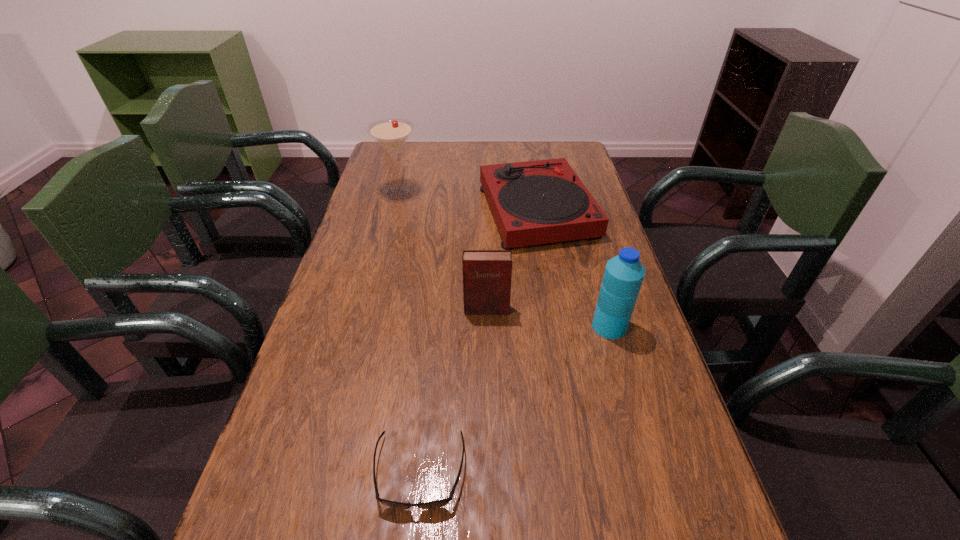
Where is `object located at the left edge`? The width and height of the screenshot is (960, 540). object located at the left edge is located at coordinates (391, 134).

Where is `water bottle present at the right edge`? water bottle present at the right edge is located at coordinates (624, 273).

Locate an element on the screen. This screenshot has width=960, height=540. record player at the right edge is located at coordinates pos(536,202).

I want to click on vacant region at the far edge, so click(x=438, y=147).

Identify the location of free region at the left edge of the desktop. (392, 177).

You are a GUI agent. You are given a task and a screenshot of the screen. Output one action in this format:
    pyautogui.click(x=<x>, y=<y>)
    Task: Click on the vacant space at the right edge
    Image resolution: width=960 pixels, height=540 pixels.
    Given the screenshot: What is the action you would take?
    pyautogui.click(x=590, y=355)

This screenshot has width=960, height=540. I want to click on free space at the far left corner of the desktop, so [x=392, y=166].

In the image, there is a desktop. Identify the location of vacant space at the far right corner. This screenshot has height=540, width=960. (545, 159).

At what (x,y) coordinates should I click in order to perform the action: click on free space between the sunglasses and the record player. Please return your answer as a coordinate pair (x, y). Looking at the image, I should click on pyautogui.click(x=478, y=341).

Where is `free space that is in between the sunglasses and the water bottle`? The height and width of the screenshot is (540, 960). free space that is in between the sunglasses and the water bottle is located at coordinates [x=515, y=399].